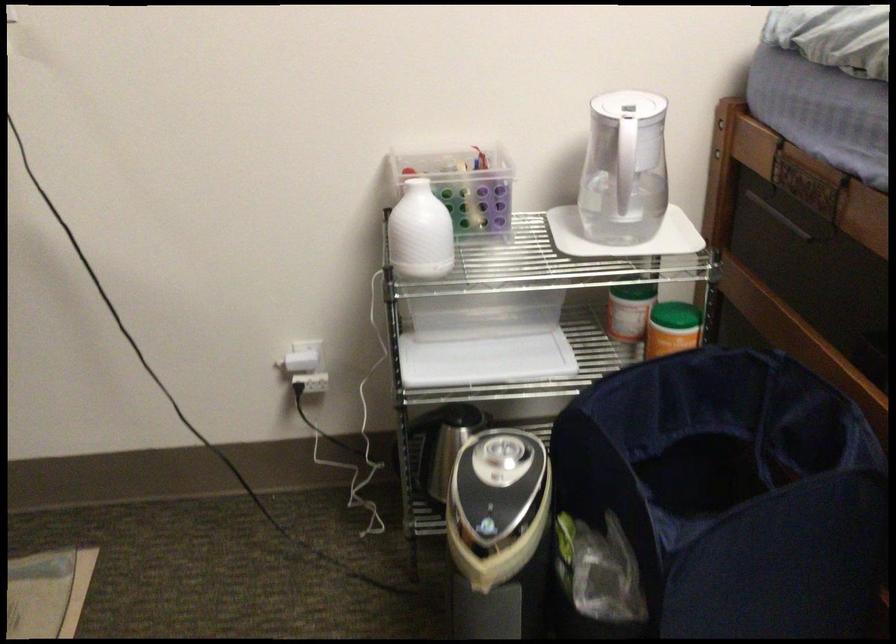
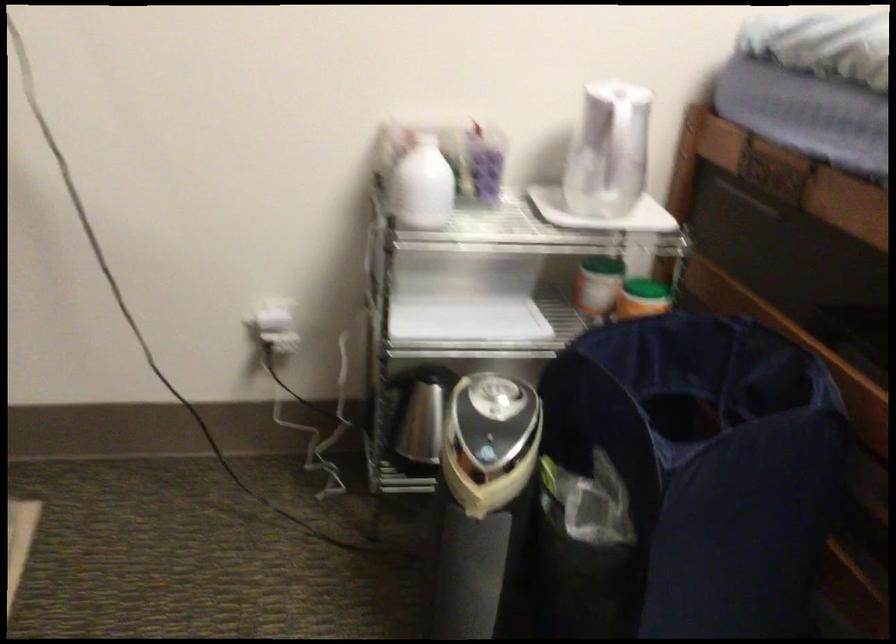
Locate, in the second image, the point that corresponds to the point at 414,237 in the first image.

(421, 185)